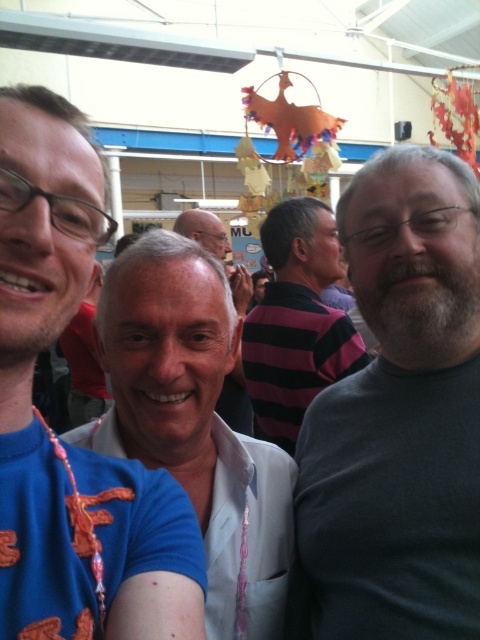
Does blue fabric shirt at left have a lesser height compared to white glossy shirt at center?

Correct, blue fabric shirt at left is not as tall as white glossy shirt at center.

Find the location of a particular element. blue fabric shirt at left is located at coordinates (41, 348).

Is dark gray t-shirt at right above striped fabric shirt at center?

Actually, dark gray t-shirt at right is below striped fabric shirt at center.

Can you confirm if dark gray t-shirt at right is positioned to the left of striped fabric shirt at center?

No, dark gray t-shirt at right is not to the left of striped fabric shirt at center.

Where is `dark gray t-shirt at right`? dark gray t-shirt at right is located at coordinates (399, 416).

At what (x,y) coordinates should I click in order to perform the action: click on dark gray t-shirt at right. Please return your answer as a coordinate pair (x, y). Looking at the image, I should click on (399, 416).

Who is taller, blue fabric shirt at left or white matte shirt at center?

Standing taller between the two is blue fabric shirt at left.

Is point (148, 595) farther from camera compared to point (238, 401)?

No, it is not.

Who is more distant from viewer, (152, 476) or (241, 310)?

Point (241, 310)

Find the location of a particular element. blue fabric shirt at left is located at coordinates (41, 348).